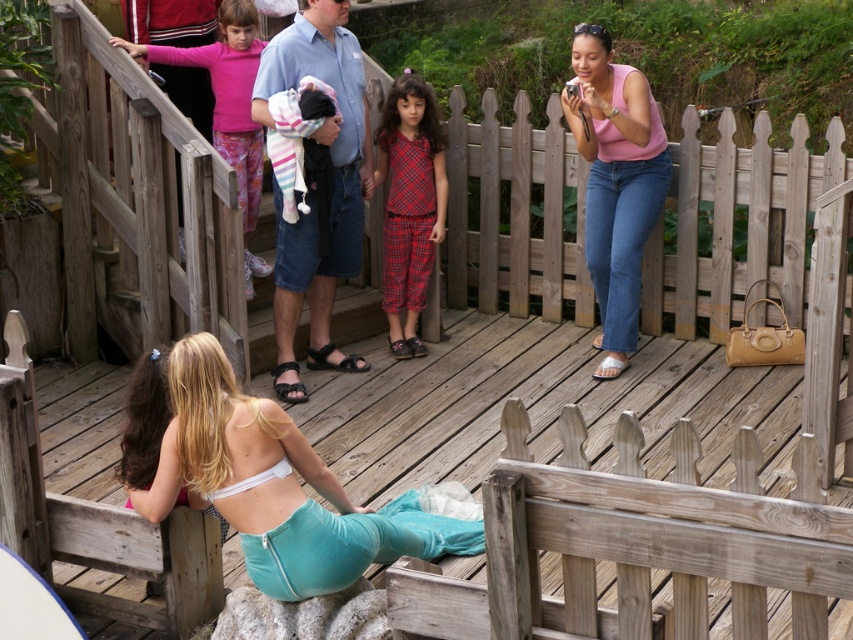
You are a photographer positioned at the center of the deck. You want to capture a photo that includes both the pink matte tank top at upper right and the pink fabric at upper left. What is the minimum distance you need to move forward to ensure both objects are in frame?

The pink matte tank top at upper right is 2.62 meters from the pink fabric at upper left. To capture both in the photo, you need to move forward at least 2.62 meters to ensure both are within the frame.

You are a photographer trying to capture a photo of the white matte bikini top at lower center without the pink matte tank top at upper right appearing in the background. Is this possible based on their positions?

Yes, since the white matte bikini top at lower center is in front of the pink matte tank top at upper right, you can position the camera to focus on the bikini top while blocking the tank top from view by adjusting the angle or using the bikini top to obscure the background.